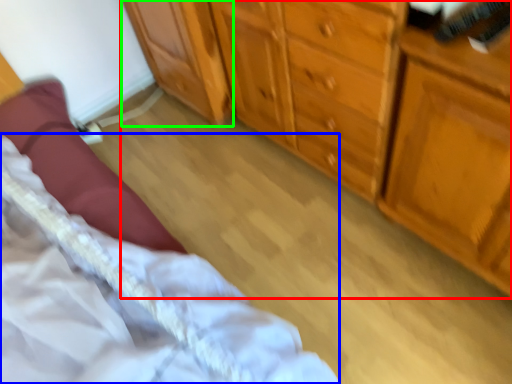
Question: Which is nearer to the chest of drawers (highlighted by a red box)? bed (highlighted by a blue box) or cabinetry (highlighted by a green box).

Choices:
 (A) bed
 (B) cabinetry

Answer: (B)